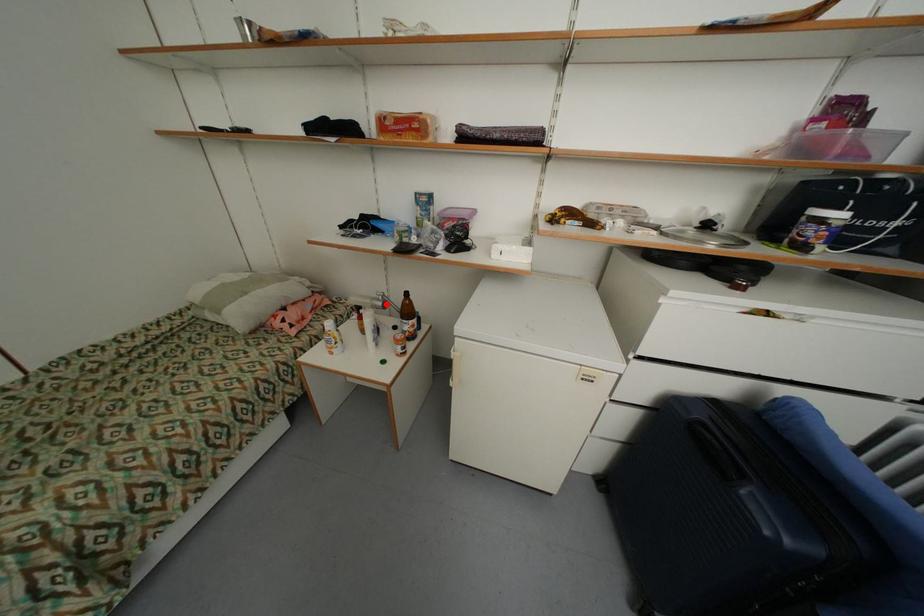
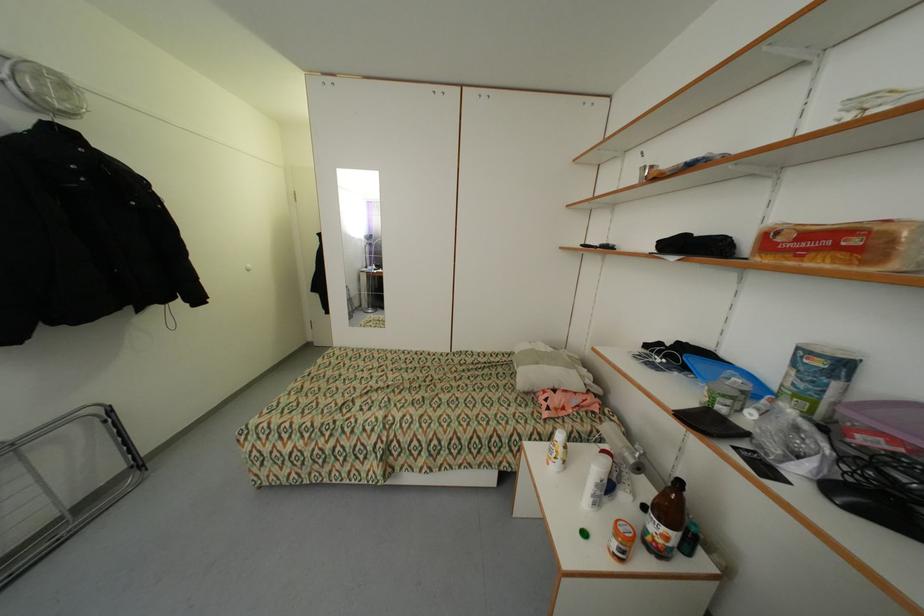
Question: I am providing you with two images of the same scene from different viewpoints. Image1 has a red point marked. In image2, the corresponding 3D location appears at what relative position? Reply with the corresponding letter.

Choices:
 (A) Closer
 (B) Farther

Answer: (A)